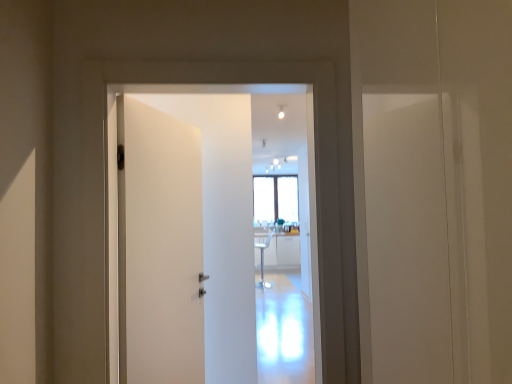
Question: Based on their sizes in the image, would you say white matte door at center is bigger or smaller than white glossy light bulb at upper center?

Choices:
 (A) big
 (B) small

Answer: (A)

Question: Is white matte door at center situated inside white glossy light bulb at upper center or outside?

Choices:
 (A) outside
 (B) inside

Answer: (A)

Question: Is white matte door at center taller or shorter than white glossy light bulb at upper center?

Choices:
 (A) short
 (B) tall

Answer: (B)

Question: Relative to white matte door at center, is white glossy light bulb at upper center in front or behind?

Choices:
 (A) behind
 (B) front

Answer: (A)

Question: Is white glossy light bulb at upper center inside or outside of white matte door at center?

Choices:
 (A) inside
 (B) outside

Answer: (B)

Question: Based on their positions, is white glossy light bulb at upper center located to the left or right of white matte door at center?

Choices:
 (A) left
 (B) right

Answer: (B)

Question: From the image's perspective, is white glossy light bulb at upper center positioned above or below white matte door at center?

Choices:
 (A) below
 (B) above

Answer: (B)